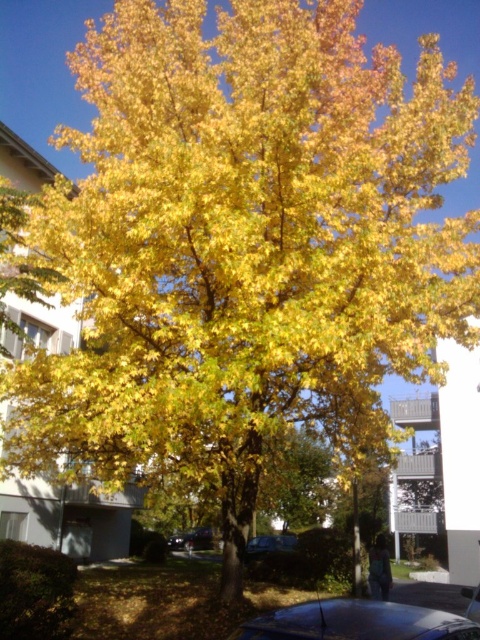
Question: Which object is positioned closest to the glossy metallic car at lower center?

Choices:
 (A) shiny black car at center
 (B) metallic blue car at center

Answer: (B)

Question: Which is nearer to the metallic blue car at center?

Choices:
 (A) shiny black car at center
 (B) glossy metallic car at lower center

Answer: (A)

Question: Does glossy metallic car at lower center have a lesser width compared to shiny black car at center?

Choices:
 (A) no
 (B) yes

Answer: (A)

Question: Which point appears closest to the camera in this image?

Choices:
 (A) (200, 540)
 (B) (350, 636)
 (C) (285, 548)

Answer: (B)

Question: Is glossy metallic car at lower center closer to camera compared to metallic blue car at center?

Choices:
 (A) yes
 (B) no

Answer: (A)

Question: Does metallic blue car at center appear over shiny black car at center?

Choices:
 (A) no
 (B) yes

Answer: (B)